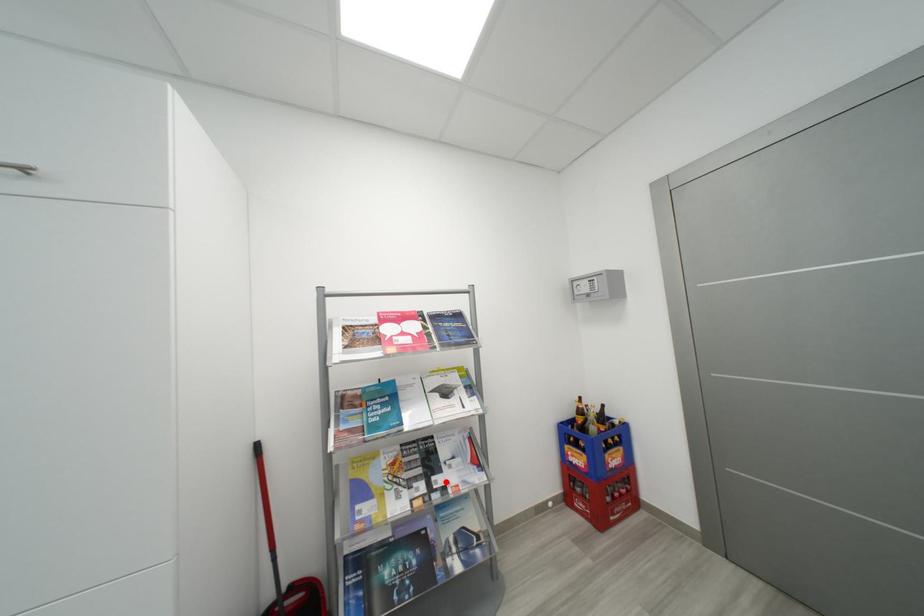
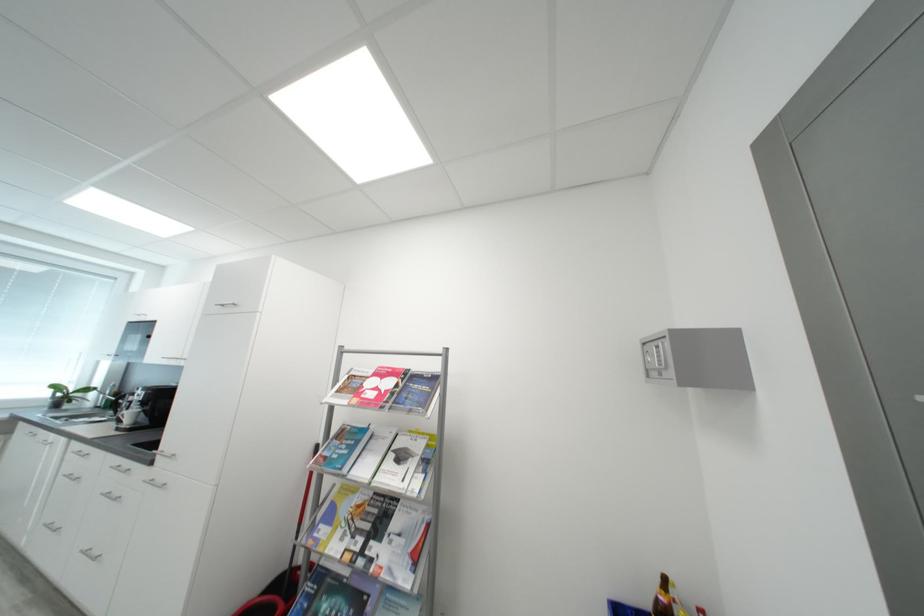
Find the pixel in the second image that matches the highlighted location in the first image.

(380, 549)